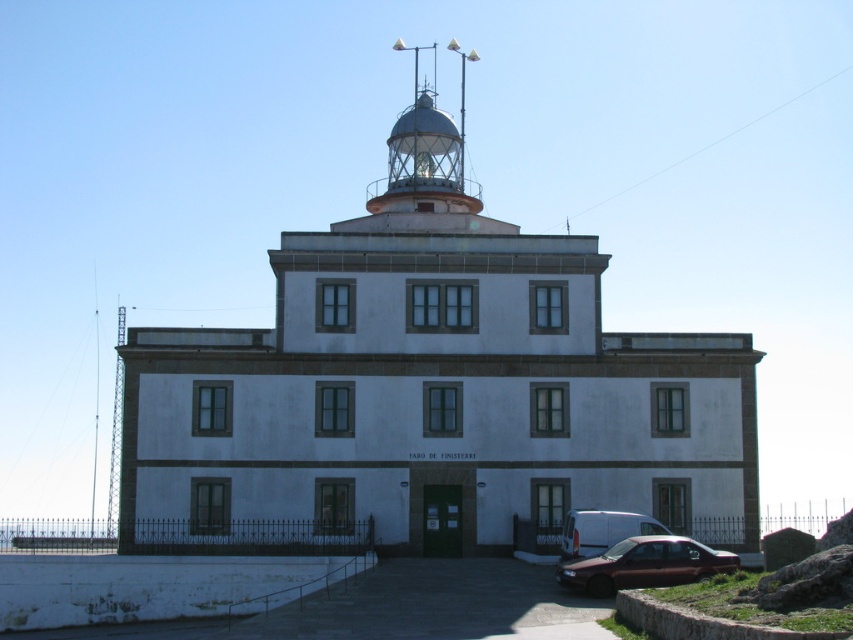
Who is positioned more to the right, metallic dome at upper center or shiny maroon sedan at lower right?

shiny maroon sedan at lower right is more to the right.

Between point (387, 200) and point (602, 554), which one is positioned behind?

The point (387, 200) is more distant.

Where is `metallic dome at upper center`? The height and width of the screenshot is (640, 853). metallic dome at upper center is located at coordinates (426, 150).

Is metallic dome at upper center closer to the viewer compared to metallic silver van at lower center?

No, metallic dome at upper center is further to the viewer.

Who is lower down, metallic dome at upper center or metallic silver van at lower center?

metallic silver van at lower center is below.

Which is in front, point (467, 54) or point (621, 516)?

Point (621, 516) is in front.

Locate an element on the screen. This screenshot has height=640, width=853. metallic dome at upper center is located at coordinates (426, 150).

Between shiny maroon sedan at lower right and metallic silver van at lower center, which one has less height?

Standing shorter between the two is metallic silver van at lower center.

Is shiny maroon sedan at lower right bigger than metallic silver van at lower center?

Yes.

Who is more distant from viewer, (704, 554) or (614, 513)?

Point (614, 513)

At what (x,y) coordinates should I click in order to perform the action: click on shiny maroon sedan at lower right. Please return your answer as a coordinate pair (x, y). This screenshot has width=853, height=640. Looking at the image, I should click on (645, 564).